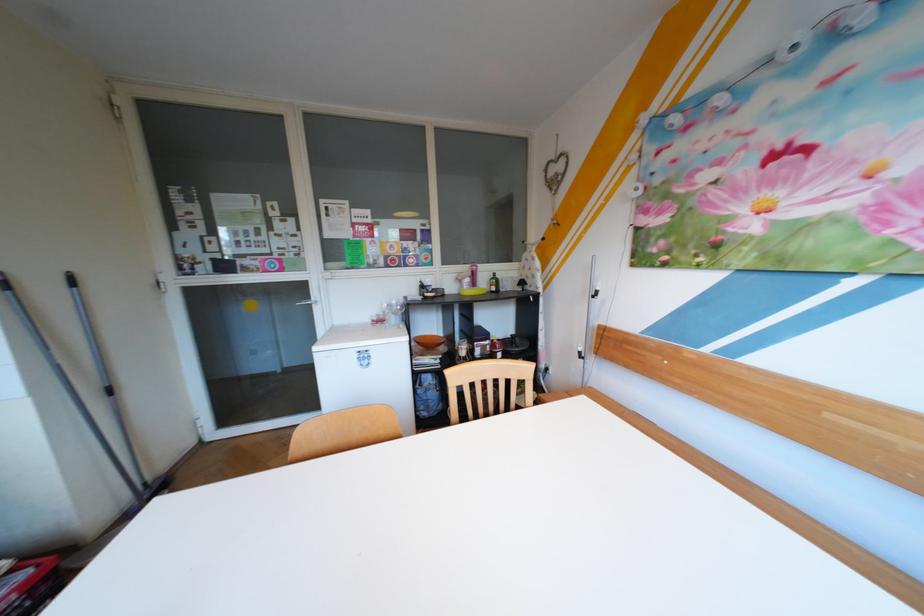
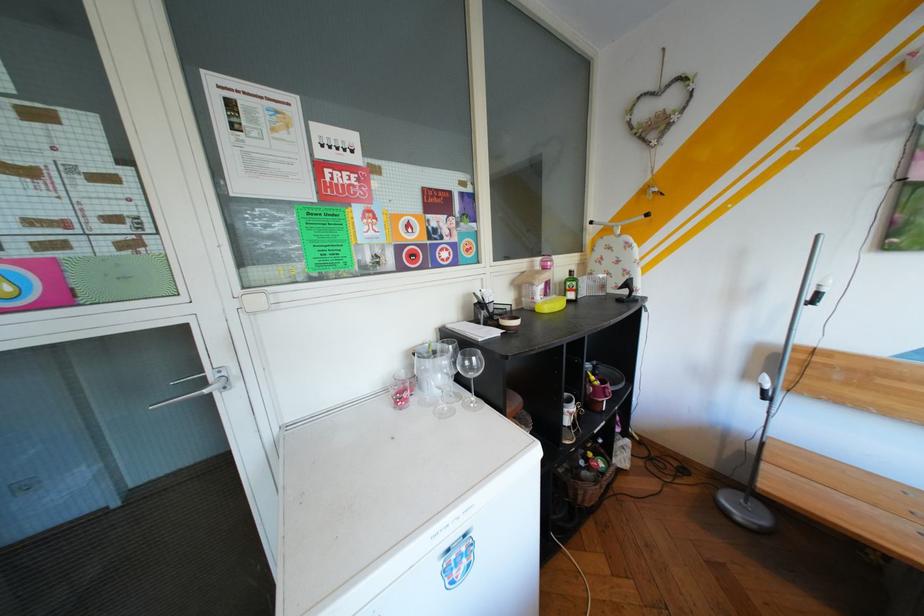
Locate, in the second image, the point that corresponds to the point at 592,352 in the first image.

(776, 390)